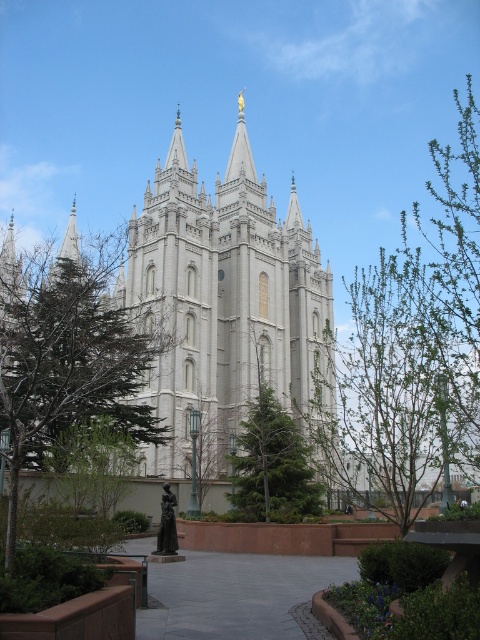
You are standing in front of the white stone church at center and want to take a photo of it. There is a green leafy tree at right in the way. Can the tree be seen in the photo if you frame the shot to include the entire church?

The white stone church at center is shorter than the green leafy tree at right, so if you frame the shot to include the entire church, the taller green leafy tree at right will likely be visible in the photo.

You are standing in front of the grand building and want to take a photo that includes both the green leafy tree at right and the green leafy tree at lower left. Which tree should you move closer to in order to include both in your frame?

You should move closer to the green leafy tree at lower left because it is smaller in size than the green leafy tree at right. By moving closer to the smaller tree, you can better frame both trees within the camera view.